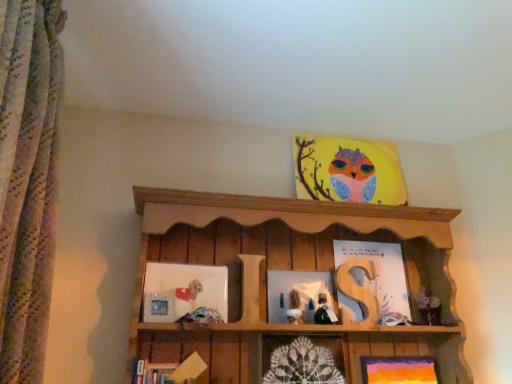
The image size is (512, 384). I want to click on wooden shelf at upper center, so click(x=290, y=269).

How much space does matte glass picture frame at center, the 3th picture frame positioned from the bottom, occupy horizontally?

matte glass picture frame at center, the 3th picture frame positioned from the bottom, is 1.43 inches in width.

This screenshot has height=384, width=512. What do you see at coordinates (296, 289) in the screenshot? I see `matte glass picture frame at center, acting as the 4th picture frame starting from the top` at bounding box center [296, 289].

In order to face matte paper owl at upper center, the sixth picture frame positioned from the bottom, should I rotate leftwards or rightwards?

You should rotate right by 12.617 degrees.

The image size is (512, 384). Identify the location of white fabric doll at center, the first toy when ordered from left to right. (294, 308).

Identify the location of matte orange painting at lower right, the sixth picture frame from the top. The height and width of the screenshot is (384, 512). (398, 370).

You are a GUI agent. You are given a task and a screenshot of the screen. Output one action in this format:
    pyautogui.click(x=<x>, y=<y>)
    Task: Click on the matte silver picture frame at lower left, which is counted as the fourth picture frame, starting from the bottom
    The width and height of the screenshot is (512, 384).
    Given the screenshot: What is the action you would take?
    [x=159, y=307]

How much distance is there between matte white picture frame at left, which is the second picture frame in top-to-bottom order, and green glass bottle at center, arranged as the 2th toy when viewed from the left?

44.59 centimeters.

Who is more distant, matte white picture frame at left, which is the second picture frame in top-to-bottom order, or green glass bottle at center, arranged as the 2th toy when viewed from the left?

Positioned behind is green glass bottle at center, arranged as the 2th toy when viewed from the left.

From the image's perspective, which one is positioned lower, matte white picture frame at left, which is the second picture frame in top-to-bottom order, or green glass bottle at center, arranged as the 2th toy when viewed from the left?

From the image's view, green glass bottle at center, arranged as the 2th toy when viewed from the left, is below.

What's the angular difference between matte white picture frame at left, marked as the fifth picture frame in a bottom-to-top arrangement, and green glass bottle at center, the first toy viewed from the right,'s facing directions?

matte white picture frame at left, marked as the fifth picture frame in a bottom-to-top arrangement, and green glass bottle at center, the first toy viewed from the right, are facing 5.58 degrees away from each other.

Is matte orange painting at lower right, the sixth picture frame from the top, located outside white lace doily at lower center, the 5th picture frame in the top-to-bottom sequence?

Indeed, matte orange painting at lower right, the sixth picture frame from the top, is completely outside white lace doily at lower center, the 5th picture frame in the top-to-bottom sequence.

Considering the positions of point (428, 372) and point (293, 371), is point (428, 372) closer or farther from the camera than point (293, 371)?

Point (428, 372) is positioned farther from the camera compared to point (293, 371).

Considering the relative sizes of matte orange painting at lower right, the 1th picture frame positioned from the bottom, and white lace doily at lower center, the second picture frame from the bottom, in the image provided, is matte orange painting at lower right, the 1th picture frame positioned from the bottom, shorter than white lace doily at lower center, the second picture frame from the bottom,?

Correct, matte orange painting at lower right, the 1th picture frame positioned from the bottom, is not as tall as white lace doily at lower center, the second picture frame from the bottom.

Is white fabric doll at center, placed as the second toy when sorted from right to left, facing towards matte orange painting at lower right, the 1th picture frame positioned from the bottom?

No.

Which of these two, white fabric doll at center, the first toy when ordered from left to right, or matte orange painting at lower right, the 1th picture frame positioned from the bottom, stands taller?

matte orange painting at lower right, the 1th picture frame positioned from the bottom, is taller.

Can you confirm if white fabric doll at center, placed as the second toy when sorted from right to left, is smaller than matte orange painting at lower right, the sixth picture frame from the top?

Correct, white fabric doll at center, placed as the second toy when sorted from right to left, occupies less space than matte orange painting at lower right, the sixth picture frame from the top.

How much distance is there between white fabric doll at center, placed as the second toy when sorted from right to left, and matte orange painting at lower right, the sixth picture frame from the top?

white fabric doll at center, placed as the second toy when sorted from right to left, and matte orange painting at lower right, the sixth picture frame from the top, are 15.37 inches apart.

From the image's perspective, starting from the matte orange painting at lower right, the 1th picture frame positioned from the bottom, which picture frame is the 3rd one above? Please provide its 2D coordinates.

[(159, 307)]

Considering their positions, is matte silver picture frame at lower left, which is counted as the fourth picture frame, starting from the bottom, located in front of or behind matte orange painting at lower right, the 1th picture frame positioned from the bottom?

Visually, matte silver picture frame at lower left, which is counted as the fourth picture frame, starting from the bottom, is located in front of matte orange painting at lower right, the 1th picture frame positioned from the bottom.

Which is less distant, (x=150, y=313) or (x=391, y=358)?

The point (x=150, y=313) is in front.

In the image, is matte silver picture frame at lower left, which is counted as the fourth picture frame, starting from the bottom, on the left side or the right side of matte paper owl at upper center, which ranks as the 1th picture frame in top-to-bottom order?

In the image, matte silver picture frame at lower left, which is counted as the fourth picture frame, starting from the bottom, appears on the left side of matte paper owl at upper center, which ranks as the 1th picture frame in top-to-bottom order.

Looking at the image, does matte silver picture frame at lower left, positioned as the third picture frame in top-to-bottom order, seem bigger or smaller compared to matte paper owl at upper center, which ranks as the 1th picture frame in top-to-bottom order?

Considering their sizes, matte silver picture frame at lower left, positioned as the third picture frame in top-to-bottom order, takes up less space than matte paper owl at upper center, which ranks as the 1th picture frame in top-to-bottom order.

Between point (159, 312) and point (335, 161), which one is positioned in front?

Positioned in front is point (159, 312).

Consider the image. From the image's perspective, relative to floral fabric curtain at left, is matte orange painting at lower right, the sixth picture frame from the top, above or below?

Based on their image positions, matte orange painting at lower right, the sixth picture frame from the top, is located beneath floral fabric curtain at left.

Does matte orange painting at lower right, the sixth picture frame from the top, lie in front of floral fabric curtain at left?

No, matte orange painting at lower right, the sixth picture frame from the top, is further to the viewer.

Considering the relative sizes of matte orange painting at lower right, the sixth picture frame from the top, and floral fabric curtain at left in the image provided, is matte orange painting at lower right, the sixth picture frame from the top, shorter than floral fabric curtain at left?

Yes, matte orange painting at lower right, the sixth picture frame from the top, is shorter than floral fabric curtain at left.

From a real-world perspective, between matte orange painting at lower right, the sixth picture frame from the top, and floral fabric curtain at left, who is vertically higher?

floral fabric curtain at left is physically above.

Is point (33, 234) in front of point (169, 256)?

Yes, it is in front of point (169, 256).

Which of these two, floral fabric curtain at left or wooden shelf at upper center, is thinner?

Thinner between the two is floral fabric curtain at left.

Would you say floral fabric curtain at left is a long distance from wooden shelf at upper center?

floral fabric curtain at left is near wooden shelf at upper center, not far away.

Between floral fabric curtain at left and wooden shelf at upper center, which one has larger size?

Bigger between the two is wooden shelf at upper center.

Find the location of a particular element. the 2nd picture frame directly above the green glass bottle at center, the first toy viewed from the right (from a real-world perspective) is located at coordinates (185, 293).

The height and width of the screenshot is (384, 512). What are the coordinates of `picture frame that is the 2nd one when counting forward from the matte orange painting at lower right, the sixth picture frame from the top` in the screenshot? It's located at (302, 364).

From the image, which object appears to be farther from wooden shelf at upper center, matte orange painting at lower right, the sixth picture frame from the top, or white fabric doll at center, placed as the second toy when sorted from right to left?

matte orange painting at lower right, the sixth picture frame from the top, is positioned further to the anchor wooden shelf at upper center.

Looking at the image, which one is located further to matte silver picture frame at lower left, which is counted as the fourth picture frame, starting from the bottom, matte white picture frame at left, which is the second picture frame in top-to-bottom order, or matte orange painting at lower right, the sixth picture frame from the top?

matte orange painting at lower right, the sixth picture frame from the top, lies further to matte silver picture frame at lower left, which is counted as the fourth picture frame, starting from the bottom, than the other object.

From the image, which object appears to be nearer to matte orange painting at lower right, the 1th picture frame positioned from the bottom, matte paper owl at upper center, which ranks as the 1th picture frame in top-to-bottom order, or matte silver picture frame at lower left, which is counted as the fourth picture frame, starting from the bottom?

matte paper owl at upper center, which ranks as the 1th picture frame in top-to-bottom order, is closer to matte orange painting at lower right, the 1th picture frame positioned from the bottom.

Looking at the image, which one is located further to matte glass picture frame at center, acting as the 4th picture frame starting from the top, white lace doily at lower center, the second picture frame from the bottom, or matte paper owl at upper center, the sixth picture frame positioned from the bottom?

matte paper owl at upper center, the sixth picture frame positioned from the bottom, is positioned further to the anchor matte glass picture frame at center, acting as the 4th picture frame starting from the top.

Considering their positions, is matte orange painting at lower right, the sixth picture frame from the top, positioned closer to floral fabric curtain at left than matte silver picture frame at lower left, positioned as the third picture frame in top-to-bottom order?

matte silver picture frame at lower left, positioned as the third picture frame in top-to-bottom order, lies closer to floral fabric curtain at left than the other object.

Which object lies further to the anchor point matte white picture frame at left, which is the second picture frame in top-to-bottom order, wooden shelf at upper center or floral fabric curtain at left?

Among the two, floral fabric curtain at left is located further to matte white picture frame at left, which is the second picture frame in top-to-bottom order.

Which object lies further to the anchor point white lace doily at lower center, the 5th picture frame in the top-to-bottom sequence, white fabric doll at center, placed as the second toy when sorted from right to left, or matte orange painting at lower right, the sixth picture frame from the top?

matte orange painting at lower right, the sixth picture frame from the top, is positioned further to the anchor white lace doily at lower center, the 5th picture frame in the top-to-bottom sequence.

Based on the photo, from the image, which object appears to be nearer to white fabric doll at center, the first toy when ordered from left to right, wooden shelf at upper center or matte glass picture frame at center, acting as the 4th picture frame starting from the top?

Based on the image, matte glass picture frame at center, acting as the 4th picture frame starting from the top, appears to be nearer to white fabric doll at center, the first toy when ordered from left to right.

Locate an element on the screen. The image size is (512, 384). picture frame situated between matte silver picture frame at lower left, which is counted as the fourth picture frame, starting from the bottom, and white fabric doll at center, placed as the second toy when sorted from right to left, from left to right is located at coordinates (185, 293).

Identify the location of toy located between white fabric doll at center, the first toy when ordered from left to right, and matte orange painting at lower right, the sixth picture frame from the top, in the left-right direction. (324, 311).

I want to click on shelf located between floral fabric curtain at left and white lace doily at lower center, the second picture frame from the bottom, in the depth direction, so click(x=290, y=269).

This screenshot has height=384, width=512. Find the location of `shelf between floral fabric curtain at left and matte glass picture frame at center, the 3th picture frame positioned from the bottom, from front to back`. shelf between floral fabric curtain at left and matte glass picture frame at center, the 3th picture frame positioned from the bottom, from front to back is located at coordinates (290, 269).